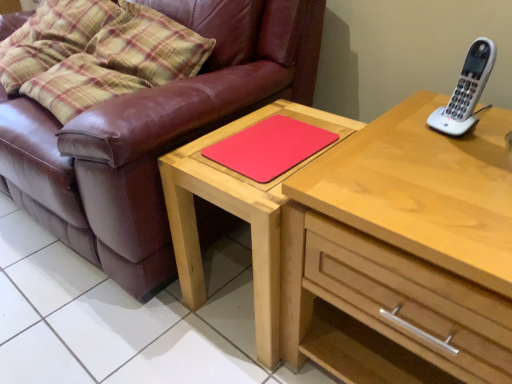
Question: Is white plastic phone at upper right shorter than matte wooden table at center?

Choices:
 (A) yes
 (B) no

Answer: (A)

Question: From a real-world perspective, is white plastic phone at upper right located higher than matte wooden table at center?

Choices:
 (A) no
 (B) yes

Answer: (B)

Question: Can you confirm if white plastic phone at upper right is taller than matte wooden table at center?

Choices:
 (A) no
 (B) yes

Answer: (A)

Question: Is matte wooden table at center inside white plastic phone at upper right?

Choices:
 (A) yes
 (B) no

Answer: (B)

Question: Can you confirm if white plastic phone at upper right is smaller than matte wooden table at center?

Choices:
 (A) no
 (B) yes

Answer: (B)

Question: From the image's perspective, is rubberized red mousepad at center above or below light wood chest of drawers at upper right?

Choices:
 (A) above
 (B) below

Answer: (A)

Question: Is point (309, 130) positioned closer to the camera than point (403, 183)?

Choices:
 (A) closer
 (B) farther

Answer: (B)

Question: Is rubberized red mousepad at center spatially inside light wood chest of drawers at upper right, or outside of it?

Choices:
 (A) inside
 (B) outside

Answer: (B)

Question: Relative to light wood chest of drawers at upper right, is rubberized red mousepad at center in front or behind?

Choices:
 (A) behind
 (B) front

Answer: (A)

Question: Is rubberized red mousepad at center in front of or behind matte wooden table at center in the image?

Choices:
 (A) behind
 (B) front

Answer: (A)

Question: In terms of width, does rubberized red mousepad at center look wider or thinner when compared to matte wooden table at center?

Choices:
 (A) wide
 (B) thin

Answer: (B)

Question: Considering the positions of rubberized red mousepad at center and matte wooden table at center in the image, is rubberized red mousepad at center taller or shorter than matte wooden table at center?

Choices:
 (A) tall
 (B) short

Answer: (B)

Question: From the image's perspective, is rubberized red mousepad at center above or below matte wooden table at center?

Choices:
 (A) above
 (B) below

Answer: (A)

Question: Is white plastic phone at upper right wider or thinner than light wood chest of drawers at upper right?

Choices:
 (A) wide
 (B) thin

Answer: (B)

Question: From a real-world perspective, is white plastic phone at upper right positioned above or below light wood chest of drawers at upper right?

Choices:
 (A) below
 (B) above

Answer: (B)